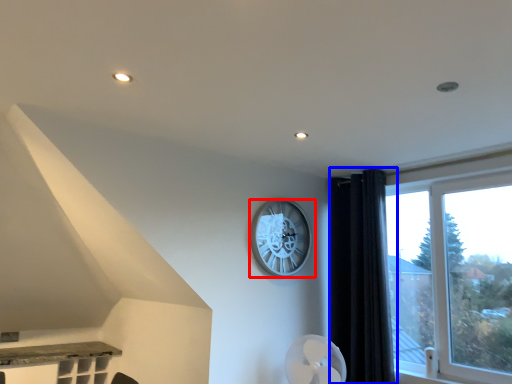
Question: Which point is closer to the camera, wall clock (highlighted by a red box) or curtain (highlighted by a blue box)?

Choices:
 (A) wall clock
 (B) curtain

Answer: (B)